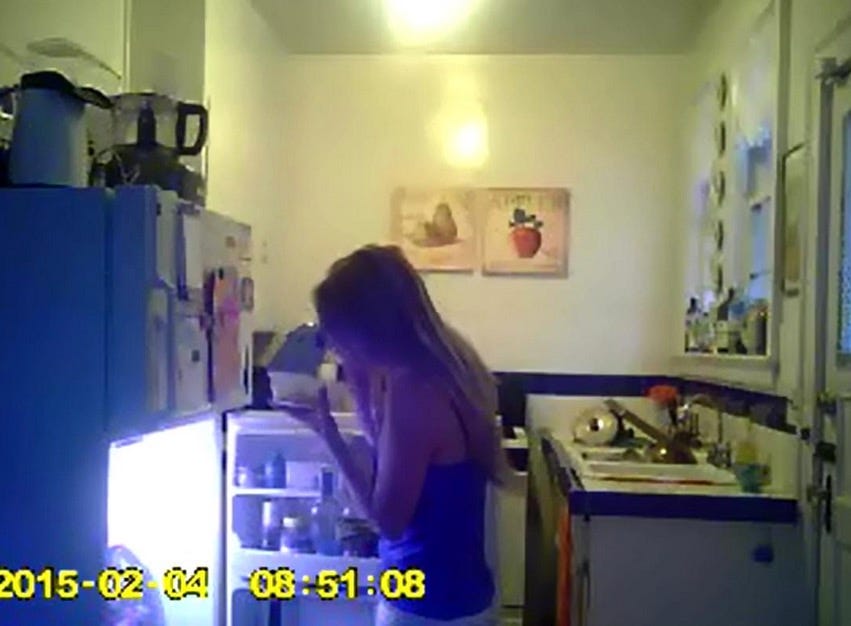
Locate an element on the screen. This screenshot has height=626, width=851. refrigerator light is located at coordinates (168, 515).